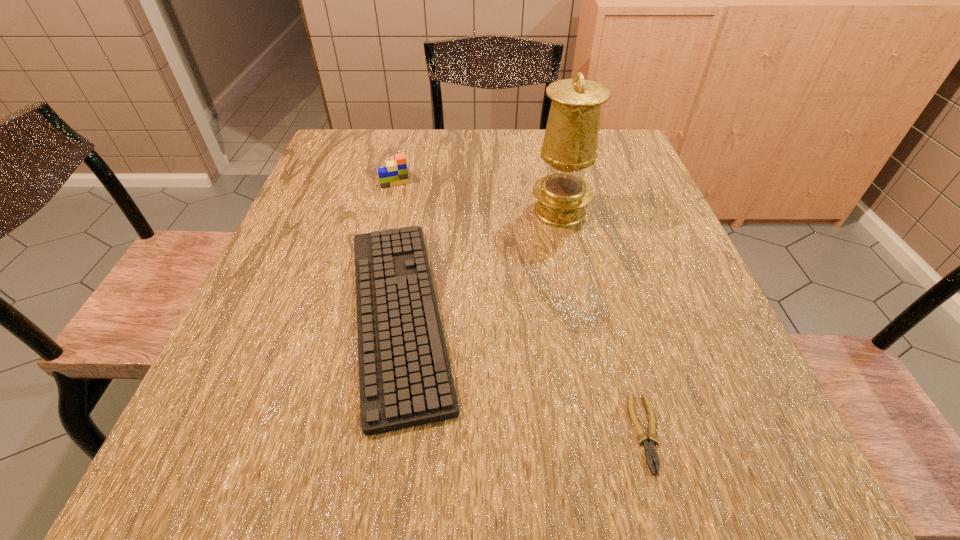
Identify the location of the third nearest object. pyautogui.click(x=570, y=142).

This screenshot has height=540, width=960. What are the coordinates of `oil lamp` in the screenshot? It's located at (570, 142).

At what (x,y) coordinates should I click in order to perform the action: click on Lego. Please return your answer as a coordinate pair (x, y). This screenshot has width=960, height=540. Looking at the image, I should click on (395, 173).

This screenshot has height=540, width=960. Find the location of `the farthest object`. the farthest object is located at coordinates (395, 173).

Identify the location of the third tallest object. This screenshot has height=540, width=960. (405, 379).

Identify the location of pliers. Image resolution: width=960 pixels, height=540 pixels. (650, 452).

Identify the location of vacant space located 0.250m on the front of the tallest object. (582, 316).

Where is `vacant region located 0.050m on the left of the Lego`? vacant region located 0.050m on the left of the Lego is located at coordinates (360, 174).

Image resolution: width=960 pixels, height=540 pixels. I want to click on free space located on the back of the third tallest object, so click(423, 166).

Where is `vacant area situated on the back of the pliers`? vacant area situated on the back of the pliers is located at coordinates (598, 259).